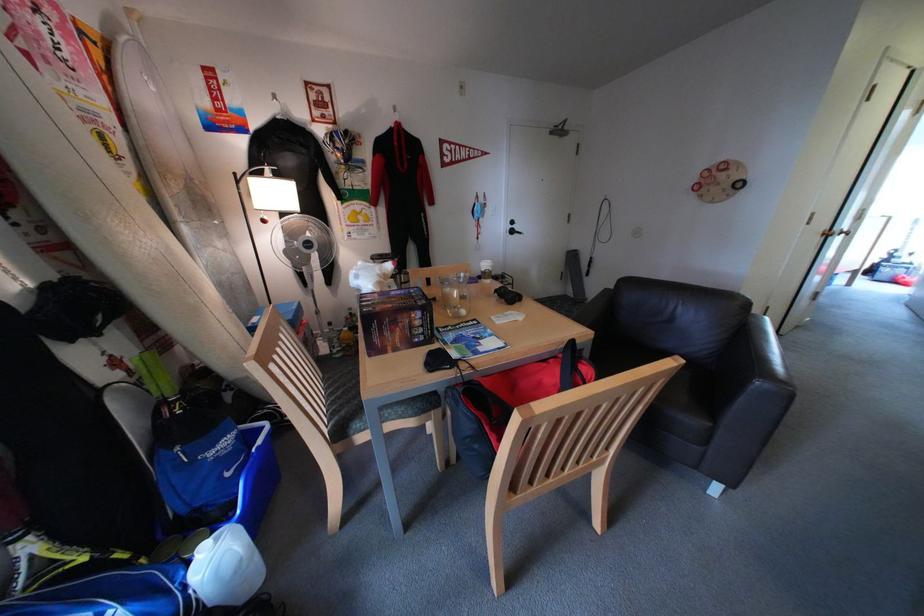
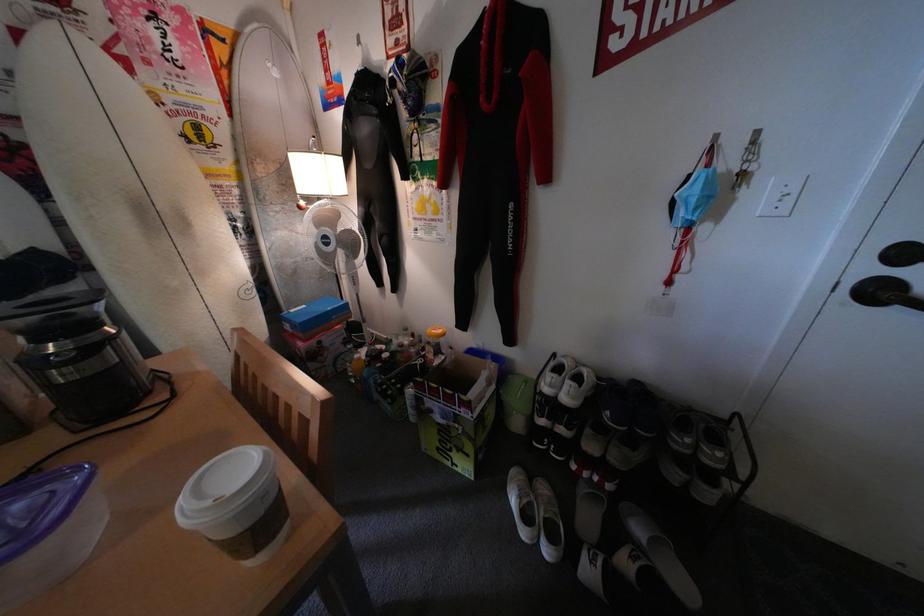
The point at [495,201] is marked in the first image. Where is the corresponding point in the second image?

(744, 161)